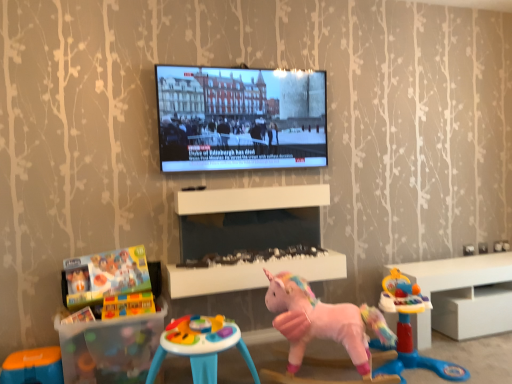
Question: Is brick-like plastic blocks at lower left, marked as the 4th toy in a right-to-left arrangement, to the left of white glossy cabinet at right from the viewer's perspective?

Choices:
 (A) yes
 (B) no

Answer: (A)

Question: Would you say brick-like plastic blocks at lower left, marked as the 4th toy in a right-to-left arrangement, contains white glossy cabinet at right?

Choices:
 (A) yes
 (B) no

Answer: (B)

Question: Is the depth of brick-like plastic blocks at lower left, the 3th toy in the left-to-right sequence, less than that of white glossy cabinet at right?

Choices:
 (A) yes
 (B) no

Answer: (A)

Question: From the image's perspective, would you say brick-like plastic blocks at lower left, the 3th toy in the left-to-right sequence, is positioned over white glossy cabinet at right?

Choices:
 (A) yes
 (B) no

Answer: (A)

Question: Can you confirm if brick-like plastic blocks at lower left, the 3th toy in the left-to-right sequence, is shorter than white glossy cabinet at right?

Choices:
 (A) no
 (B) yes

Answer: (B)

Question: In terms of height, does white glossy cabinet at right look taller or shorter compared to translucent plastic building blocks at lower left, which appears as the second toy when viewed from the left?

Choices:
 (A) tall
 (B) short

Answer: (B)

Question: Considering the positions of white glossy cabinet at right and translucent plastic building blocks at lower left, which appears as the second toy when viewed from the left, in the image, is white glossy cabinet at right wider or thinner than translucent plastic building blocks at lower left, which appears as the second toy when viewed from the left,?

Choices:
 (A) wide
 (B) thin

Answer: (A)

Question: Is white glossy cabinet at right in front of or behind translucent plastic building blocks at lower left, which appears as the second toy when viewed from the left, in the image?

Choices:
 (A) behind
 (B) front

Answer: (A)

Question: From the image's perspective, is white glossy cabinet at right above or below translucent plastic building blocks at lower left, which appears as the second toy when viewed from the left?

Choices:
 (A) below
 (B) above

Answer: (A)

Question: In terms of width, does smooth plastic table at center, which is the second table from left to right, look wider or thinner when compared to pink fabric unicorn at center, the first toy from the right?

Choices:
 (A) wide
 (B) thin

Answer: (B)

Question: Does point (169, 269) appear closer or farther from the camera than point (402, 349)?

Choices:
 (A) closer
 (B) farther

Answer: (B)

Question: Would you say smooth plastic table at center, which appears as the second table when ordered from the bottom, is inside or outside pink fabric unicorn at center, which appears as the 6th toy when viewed from the left?

Choices:
 (A) inside
 (B) outside

Answer: (B)

Question: Relative to pink fabric unicorn at center, the first toy from the right, is smooth plastic table at center, which is the second table from left to right, in front or behind?

Choices:
 (A) behind
 (B) front

Answer: (A)

Question: Considering the positions of point (x=208, y=337) and point (x=121, y=316), is point (x=208, y=337) closer or farther from the camera than point (x=121, y=316)?

Choices:
 (A) farther
 (B) closer

Answer: (B)

Question: From the image's perspective, is multicolored plastic activity table at center, the third toy in the right-to-left sequence, above or below brick-like plastic blocks at lower left, the 3th toy in the left-to-right sequence?

Choices:
 (A) below
 (B) above

Answer: (A)